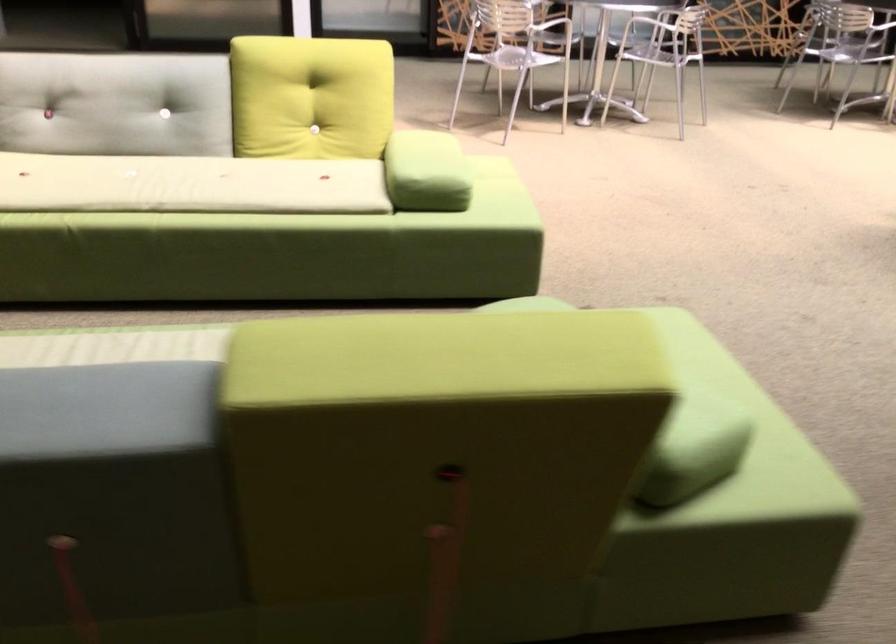
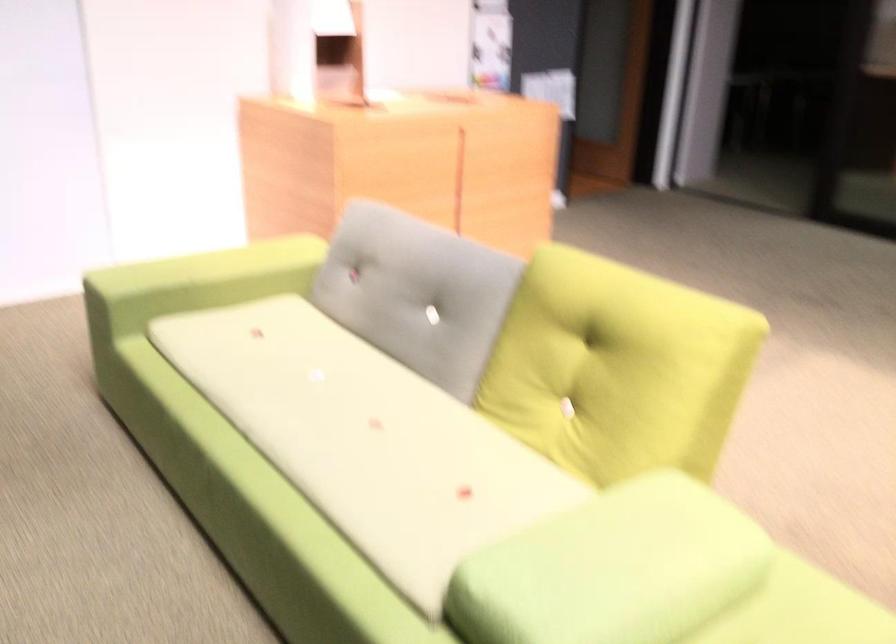
The point at (440, 151) is marked in the first image. Where is the corresponding point in the second image?

(613, 569)